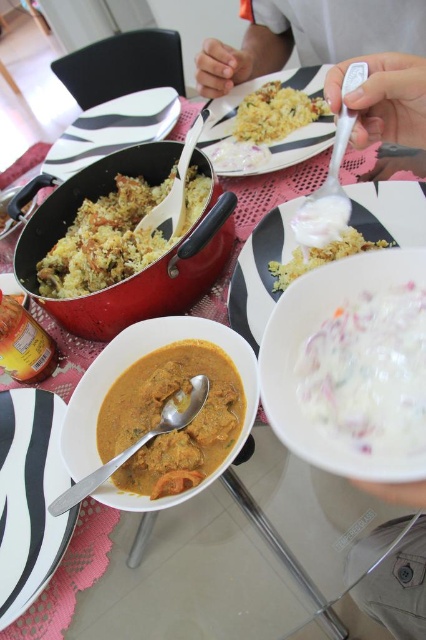
You are a chef preparing a meal and need to place a garnish between the yellow rice at center and the yellowish rice at center. How far apart should you position them?

The yellow rice at center and the yellowish rice at center are 27.24 centimeters apart, so you should position them 27.24 centimeters away from each other.

You are a guest at the table and want to use the white plastic spoon at upper center to eat from the black glossy plate at center. Can you easily reach the plate with the spoon without moving either item?

The white plastic spoon at upper center is to the right of the black glossy plate at center, so you can easily reach the plate with the spoon without needing to move them.

You are a guest at a dinner and want to choose the wider portion of rice between the yellow rice at center and the yellowish rice at center. Which one should you pick?

The yellow rice at center is wider than the yellowish rice at center, so you should pick the yellow rice at center.